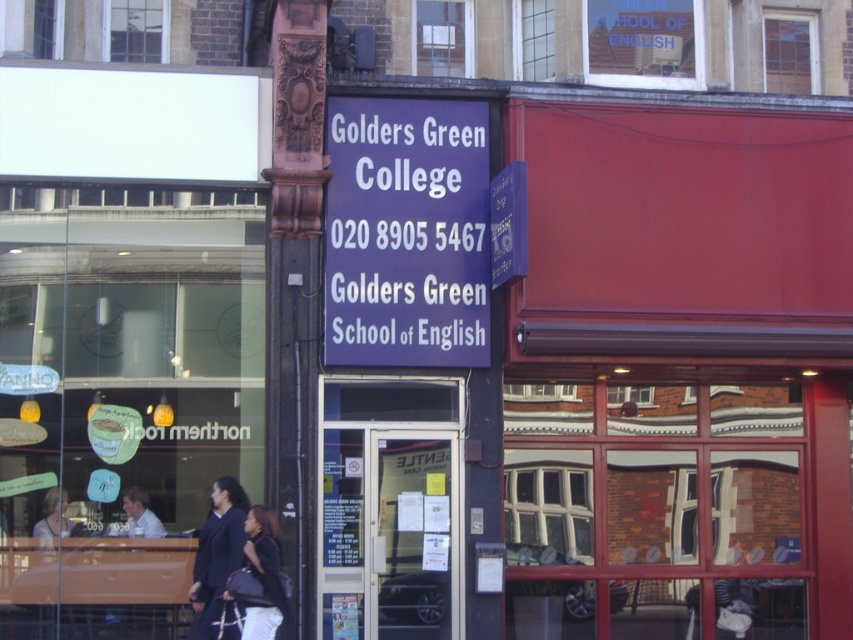
Question: Is dark blue fabric coat at center further to camera compared to matte black jacket at lower left?

Choices:
 (A) yes
 (B) no

Answer: (B)

Question: Estimate the real-world distances between objects in this image. Which object is closer to the purple matte sign at center?

Choices:
 (A) matte black jacket at lower left
 (B) matte black jacket at center

Answer: (B)

Question: Among these objects, which one is farthest from the camera?

Choices:
 (A) matte black jacket at lower left
 (B) matte black jacket at center
 (C) dark blue fabric coat at center
 (D) purple matte sign at center

Answer: (D)

Question: Is dark blue fabric coat at center positioned in front of matte black jacket at lower left?

Choices:
 (A) no
 (B) yes

Answer: (B)

Question: Which point is closer to the camera?

Choices:
 (A) (357, 362)
 (B) (67, 499)
 (C) (279, 605)

Answer: (C)

Question: Is purple matte sign at center thinner than matte black jacket at center?

Choices:
 (A) yes
 (B) no

Answer: (B)